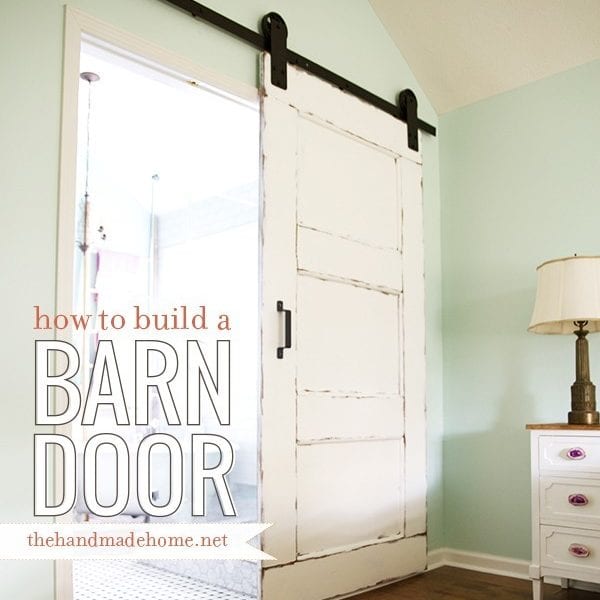
Locate an element on the screen. The width and height of the screenshot is (600, 600). word door is located at coordinates (111, 475).